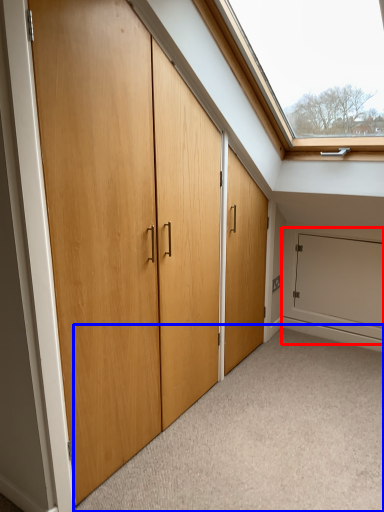
Question: Which of the following is the farthest to the observer, garage door (highlighted by a red box) or plain (highlighted by a blue box)?

Choices:
 (A) garage door
 (B) plain

Answer: (A)